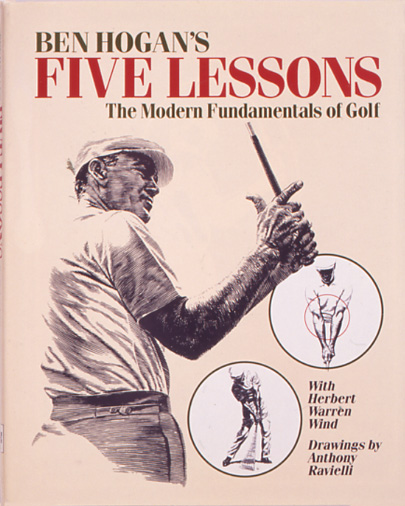
Where is `book`? book is located at coordinates (257, 346).